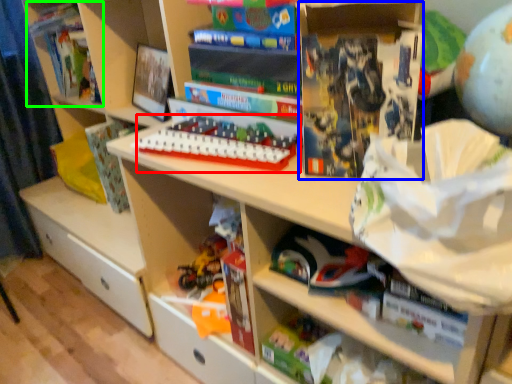
Question: Which is farther away from toy (highlighted by a red box)? paperback book (highlighted by a blue box) or book (highlighted by a green box)?

Choices:
 (A) paperback book
 (B) book

Answer: (B)